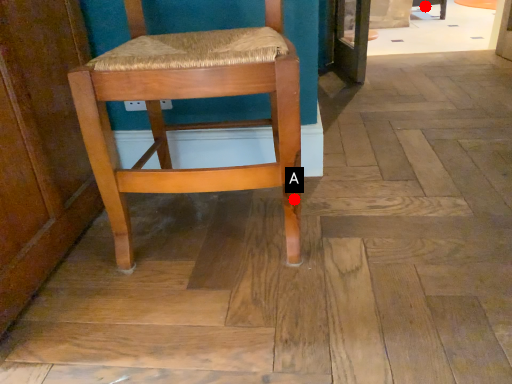
Question: Two points are circled on the image, labeled by A and B beside each circle. Among these points, which one is nearest to the camera?

Choices:
 (A) A is closer
 (B) B is closer

Answer: (A)